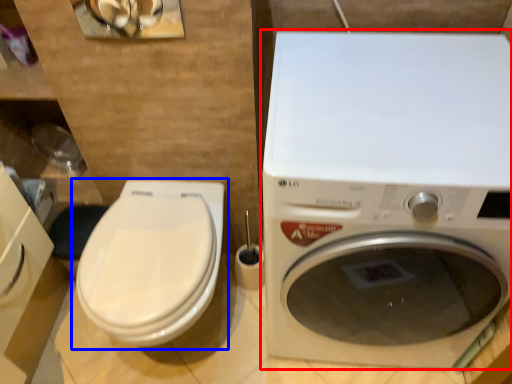
Question: Which object is closer to the camera taking this photo, washing machine (highlighted by a red box) or toilet (highlighted by a blue box)?

Choices:
 (A) washing machine
 (B) toilet

Answer: (A)